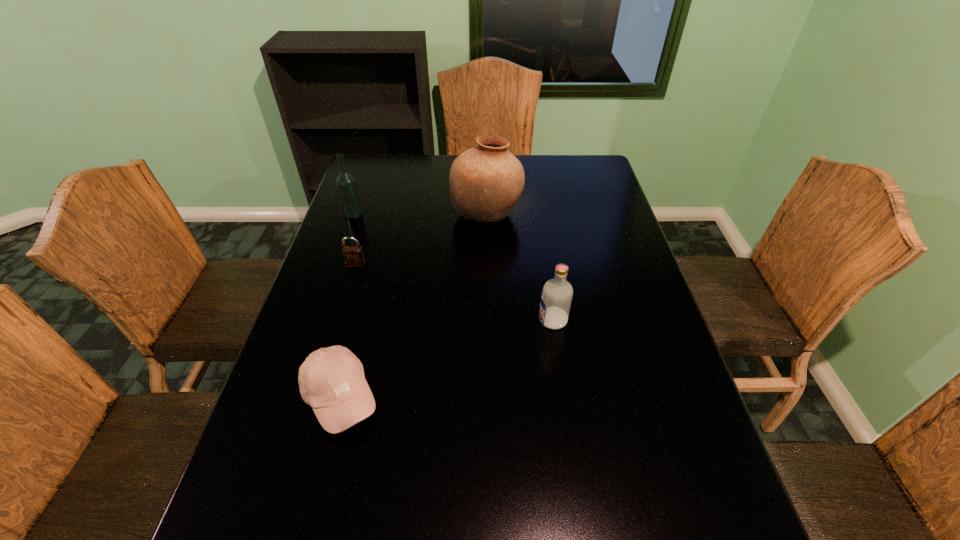
In order to click on free space at the right edge of the desktop in this screenshot , I will do `click(629, 364)`.

You are a GUI agent. You are given a task and a screenshot of the screen. Output one action in this format:
    pyautogui.click(x=<x>, y=<y>)
    Task: Click on the free space at the far left corner of the desktop
    The width and height of the screenshot is (960, 540).
    Given the screenshot: What is the action you would take?
    click(370, 164)

The height and width of the screenshot is (540, 960). In order to click on free space at the far right corner of the desktop in this screenshot , I will do `click(560, 176)`.

Locate an element on the screen. The width and height of the screenshot is (960, 540). free point between the baseball cap and the farther vodka is located at coordinates (347, 305).

The width and height of the screenshot is (960, 540). What are the coordinates of `empty space that is in between the nearer vodka and the second tallest object` in the screenshot? It's located at (453, 267).

Identify the location of free spot between the farther vodka and the pottery. (420, 213).

Identify the location of free space between the third tallest object and the nearest object. The image size is (960, 540). tap(446, 359).

Locate an element on the screen. The height and width of the screenshot is (540, 960). empty space that is in between the shorter vodka and the second tallest object is located at coordinates (453, 267).

Where is `vacant point located between the nearer vodka and the pottery`? Image resolution: width=960 pixels, height=540 pixels. vacant point located between the nearer vodka and the pottery is located at coordinates (519, 267).

The height and width of the screenshot is (540, 960). I want to click on empty location between the right vodka and the third farthest object, so click(454, 292).